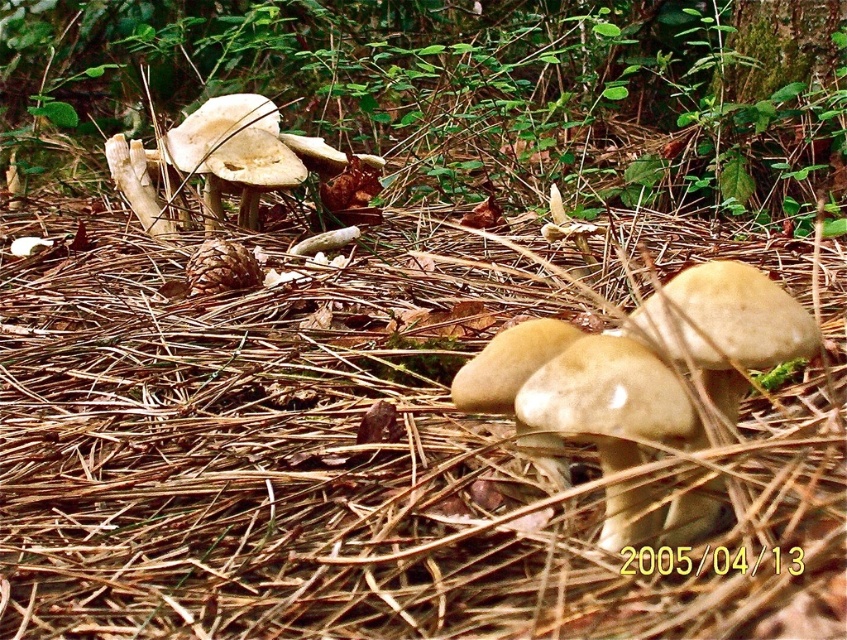
You are a forager in the forest and see both the white matte mushrooms at center and the light brown mushroom at center. Which mushroom is closer to you?

The white matte mushrooms at center are closer to you because the light brown mushroom at center is behind them.

Consider the image. You are standing at the point labeled point (125, 54) in a forest. If you want to move 3 meters closer to the viewer, how far will you be from the viewer?

The point labeled point (125, 54) is initially 5.72 meters away from the viewer. Moving 3 meters closer would reduce the distance to 5.72 meters minus 3 meters, resulting in a new distance of 2.72 meters from the viewer.

You are an artist sketching the forest floor scene. You notice two mushrooms at the center of your view. Which one has a wider cap, the white matte mushrooms at center or the light brown mushroom at center?

The white matte mushrooms at center has a wider cap than the light brown mushroom at center according to the description.